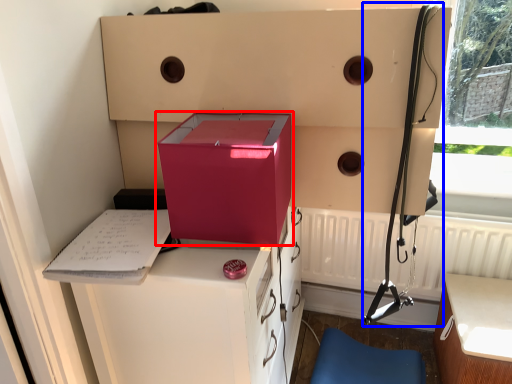
Question: Which object appears closest to the camera in this image, box (highlighted by a red box) or twin (highlighted by a blue box)?

Choices:
 (A) box
 (B) twin

Answer: (A)